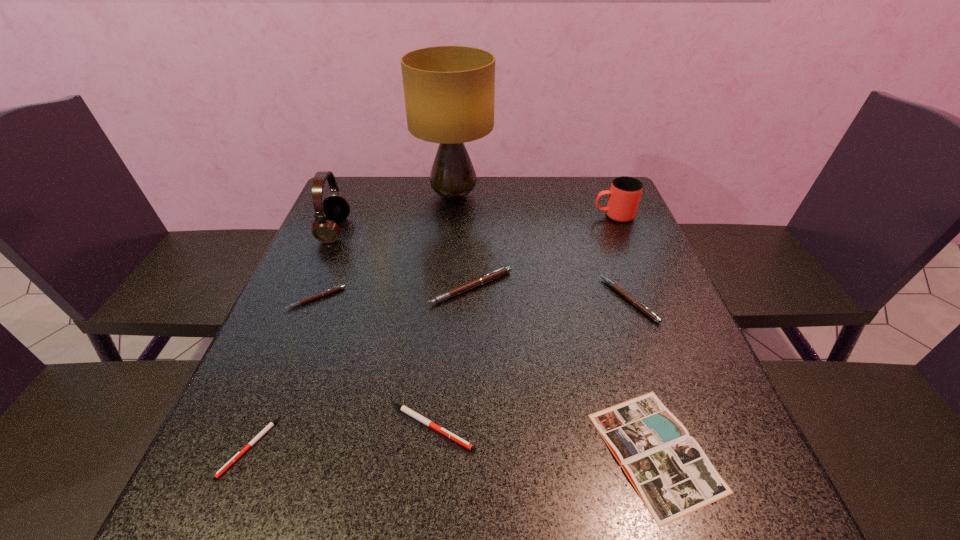
Locate an element on the screen. free space at the far edge of the desktop is located at coordinates (499, 209).

Locate an element on the screen. The width and height of the screenshot is (960, 540). vacant space at the near edge of the desktop is located at coordinates (446, 523).

Locate an element on the screen. This screenshot has height=540, width=960. vacant area at the left edge is located at coordinates (340, 257).

Where is `free space at the right edge of the desktop`? Image resolution: width=960 pixels, height=540 pixels. free space at the right edge of the desktop is located at coordinates (631, 319).

At what (x,y) coordinates should I click in order to perform the action: click on vacant space at the near left corner of the desktop. Please return your answer as a coordinate pair (x, y). This screenshot has height=540, width=960. Looking at the image, I should click on tap(210, 519).

In the image, there is a desktop. Identify the location of blank space at the far right corner. (599, 217).

Where is `free space between the fourth tallest object and the tallest object`? The width and height of the screenshot is (960, 540). free space between the fourth tallest object and the tallest object is located at coordinates (463, 242).

Where is `free space between the leftmost pink pen and the pink cup`? The width and height of the screenshot is (960, 540). free space between the leftmost pink pen and the pink cup is located at coordinates (466, 257).

Where is `empty location between the pink cup and the second smallest pink pen`? empty location between the pink cup and the second smallest pink pen is located at coordinates (621, 258).

In order to click on vacant area that lies between the book and the left white pen in this screenshot , I will do `click(452, 449)`.